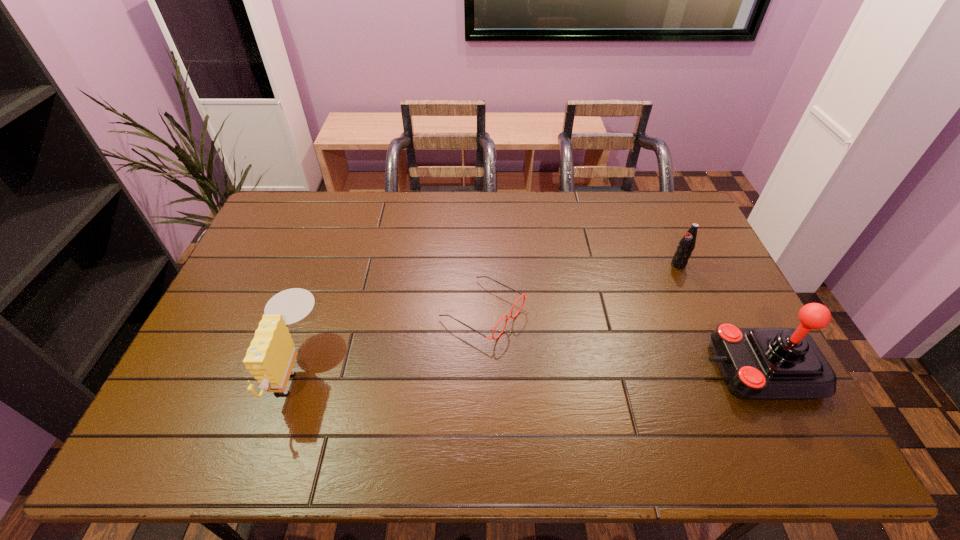
This screenshot has height=540, width=960. What are the coordinates of `vacant space at the far right corner` in the screenshot? It's located at (662, 218).

Find the location of a particular element. This screenshot has height=540, width=960. free space at the near right corner of the desktop is located at coordinates point(746,401).

The image size is (960, 540). Identify the location of vacant space in between the spectacles and the leftmost object. (389, 340).

This screenshot has height=540, width=960. I want to click on unoccupied position between the third tallest object and the leftmost object, so click(487, 317).

I want to click on free spot between the joystick and the pop, so click(719, 316).

What are the coordinates of `free space between the pop and the sponge` in the screenshot? It's located at (487, 317).

Find the location of a particular element. The width and height of the screenshot is (960, 540). unoccupied area between the third tallest object and the tallest object is located at coordinates (719, 316).

Locate an element on the screen. free space between the tallest object and the spectacles is located at coordinates (621, 340).

The width and height of the screenshot is (960, 540). In order to click on free space between the joystick and the pop in this screenshot , I will do `click(719, 316)`.

I want to click on vacant area between the third tallest object and the joystick, so click(719, 316).